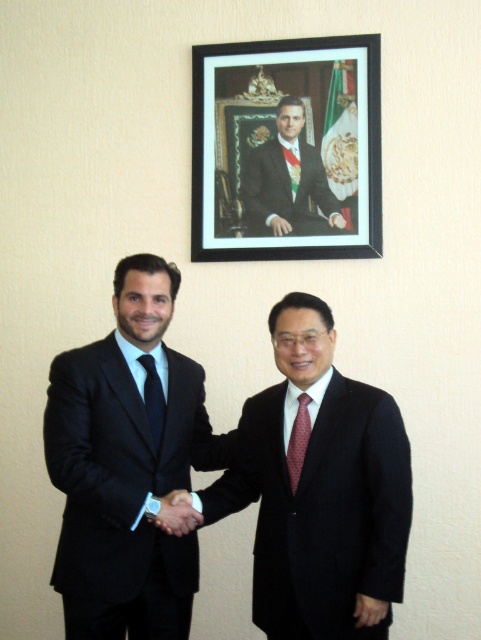
Describe the element at coordinates (126, 467) in the screenshot. The height and width of the screenshot is (640, 481). I see `matte black suit at left` at that location.

Is matte black suit at left wider than matte black suit at upper center?

Indeed, matte black suit at left has a greater width compared to matte black suit at upper center.

Describe the element at coordinates (126, 467) in the screenshot. This screenshot has height=640, width=481. I see `matte black suit at left` at that location.

Image resolution: width=481 pixels, height=640 pixels. I want to click on matte black suit at left, so click(x=126, y=467).

Is the position of matte black suit at left more distant than that of black matte picture frame at upper center?

That is False.

Is point (129, 428) positioned before point (332, 200)?

Yes.

I want to click on matte black suit at left, so click(126, 467).

Which is more to the left, black matte picture frame at upper center or polka dot silk tie at center?

black matte picture frame at upper center

Is black matte picture frame at upper center above polka dot silk tie at center?

Correct, black matte picture frame at upper center is located above polka dot silk tie at center.

What do you see at coordinates (287, 147) in the screenshot? I see `black matte picture frame at upper center` at bounding box center [287, 147].

The height and width of the screenshot is (640, 481). What are the coordinates of `black matte picture frame at upper center` in the screenshot? It's located at (287, 147).